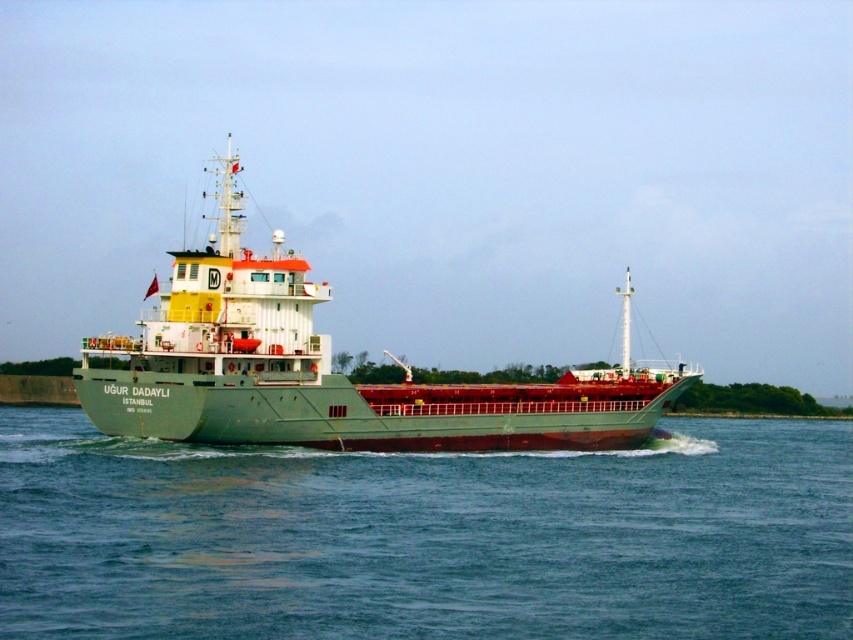
Does green water at center appear under green matte ship at center?

Correct, green water at center is located below green matte ship at center.

How distant is green water at center from green matte ship at center?

The distance of green water at center from green matte ship at center is 12.38 meters.

Who is more forward, (552, 493) or (225, 266)?

Positioned in front is point (552, 493).

You are a GUI agent. You are given a task and a screenshot of the screen. Output one action in this format:
    pyautogui.click(x=<x>, y=<y>)
    Task: Click on the green water at center
    The width and height of the screenshot is (853, 640).
    Given the screenshot: What is the action you would take?
    pyautogui.click(x=425, y=536)